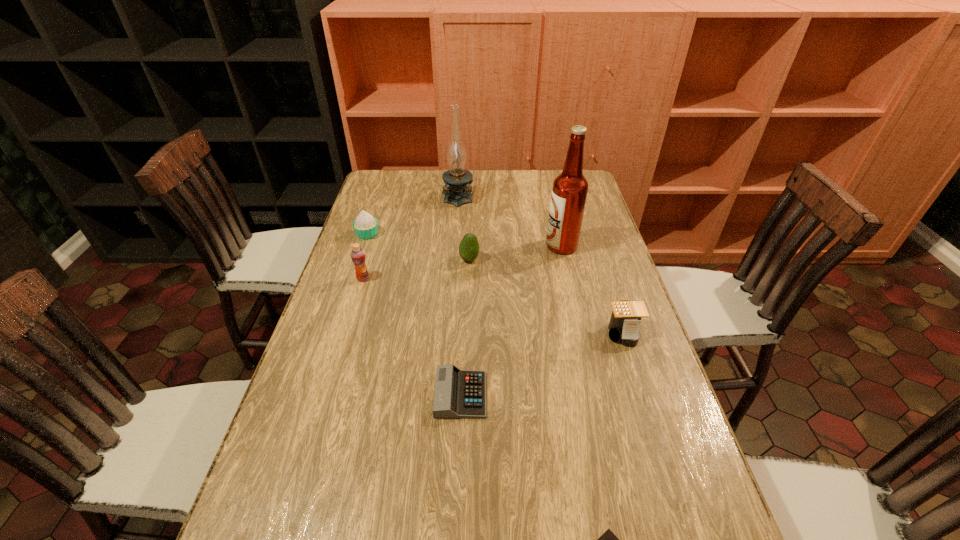
Image resolution: width=960 pixels, height=540 pixels. Identify the location of alcohol. (569, 192).

Where is `the farthest object`? the farthest object is located at coordinates (457, 180).

Locate an element on the screen. Image resolution: width=960 pixels, height=540 pixels. the fourth nearest object is located at coordinates (358, 257).

Find the location of a particular element. This screenshot has width=960, height=540. the sixth shortest object is located at coordinates click(358, 257).

This screenshot has height=540, width=960. Find the location of `avocado`. avocado is located at coordinates (469, 247).

What are the coordinates of `cupcake` in the screenshot? It's located at (365, 225).

Identify the location of the tallest calculator. Image resolution: width=960 pixels, height=540 pixels. (624, 324).

This screenshot has height=540, width=960. Find the location of `the rightmost calculator`. the rightmost calculator is located at coordinates (624, 324).

Find the location of a particular element. the leftmost calculator is located at coordinates (458, 393).

You are a GUI agent. You are given a task and a screenshot of the screen. Output one action in this format:
    pyautogui.click(x=<x>, y=<y>)
    Task: Click on the seventh farthest object
    
    Given the screenshot: What is the action you would take?
    pyautogui.click(x=458, y=393)